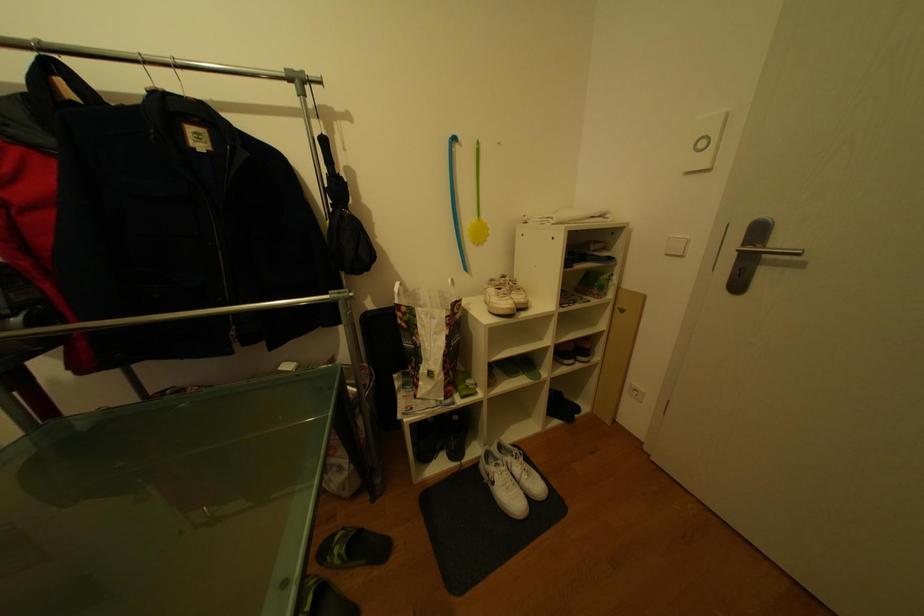
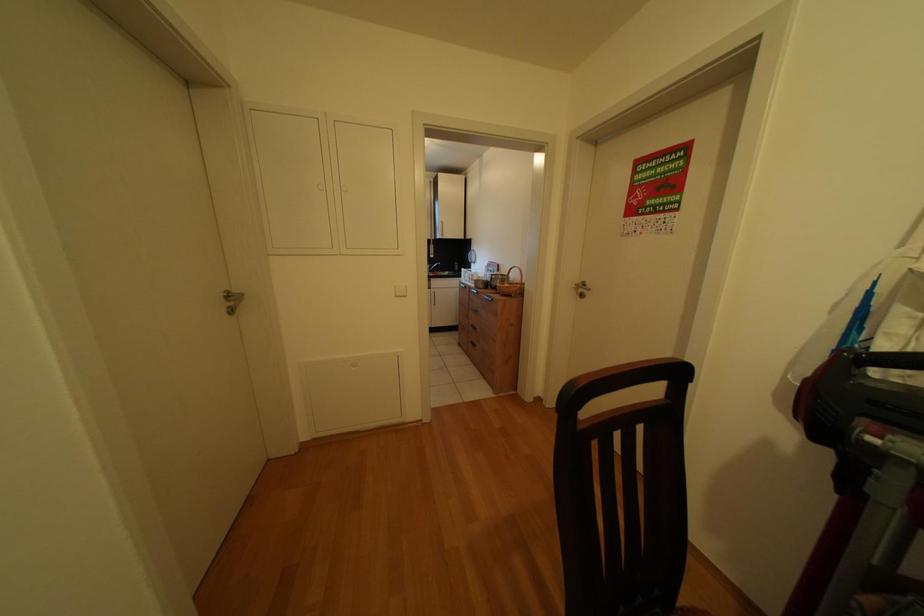
Consider the image. How did the camera likely rotate?

The camera's rotation is toward left-down.